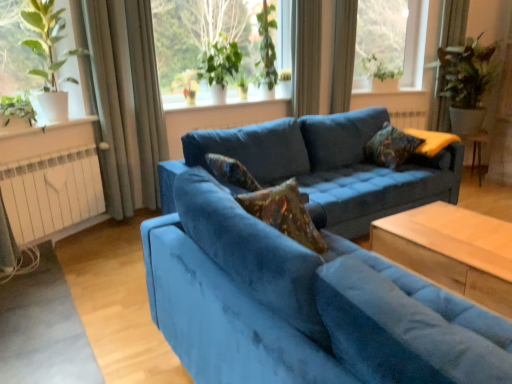
Identify the location of vacant area situated below white metallic radiator at lower left (from a real-world perspective). (71, 244).